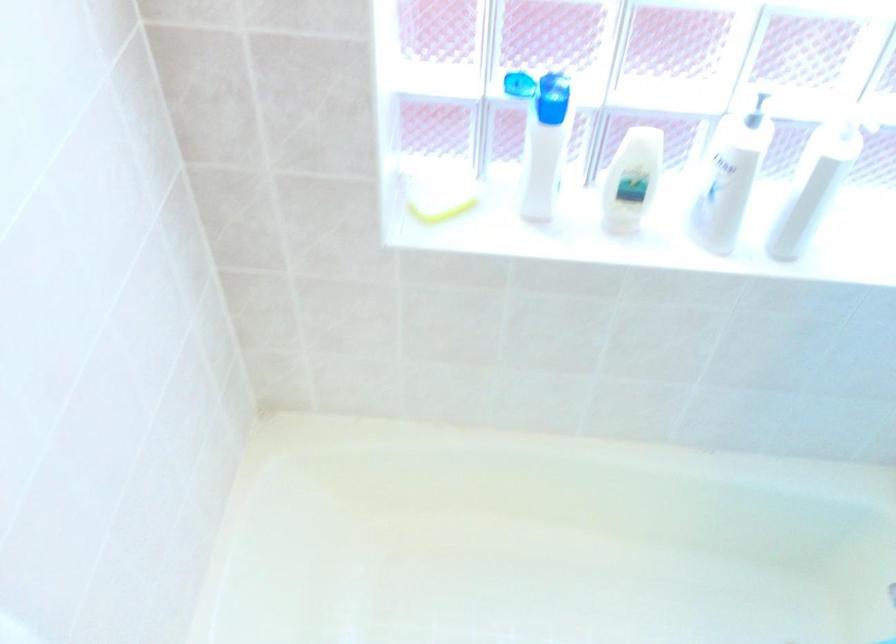
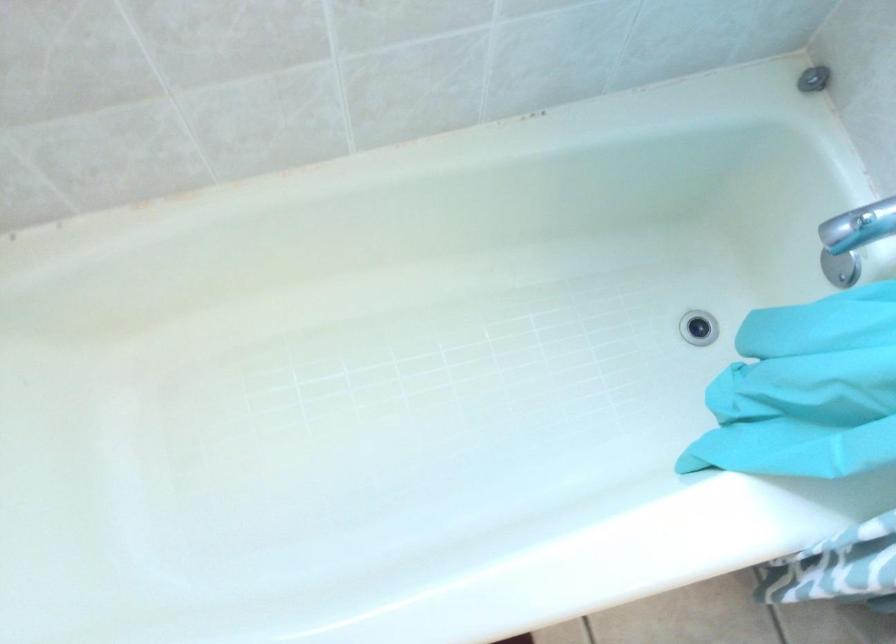
Question: Based on the continuous images, in which direction is the camera rotating? Reply with the corresponding letter.

Choices:
 (A) Left
 (B) Right
 (C) Up
 (D) Down

Answer: (D)